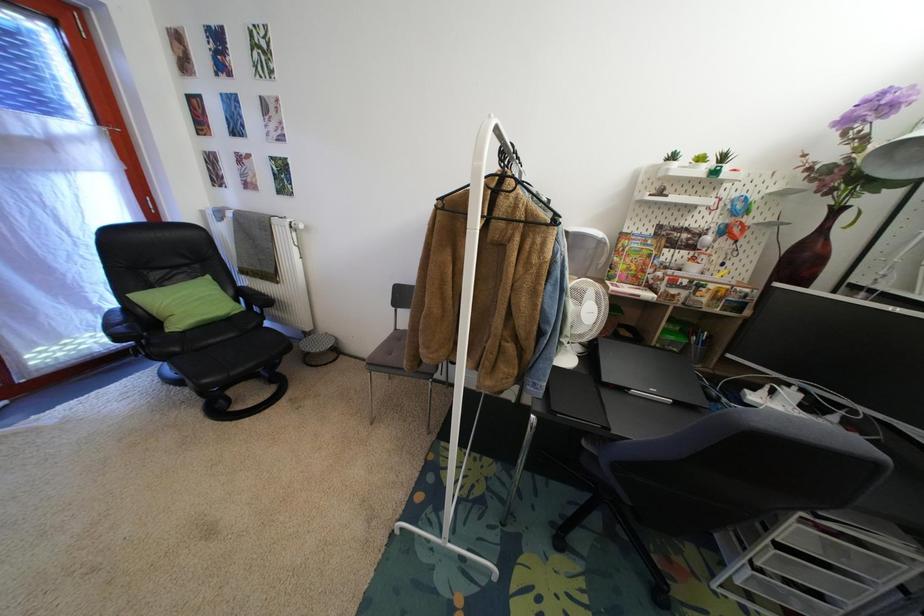
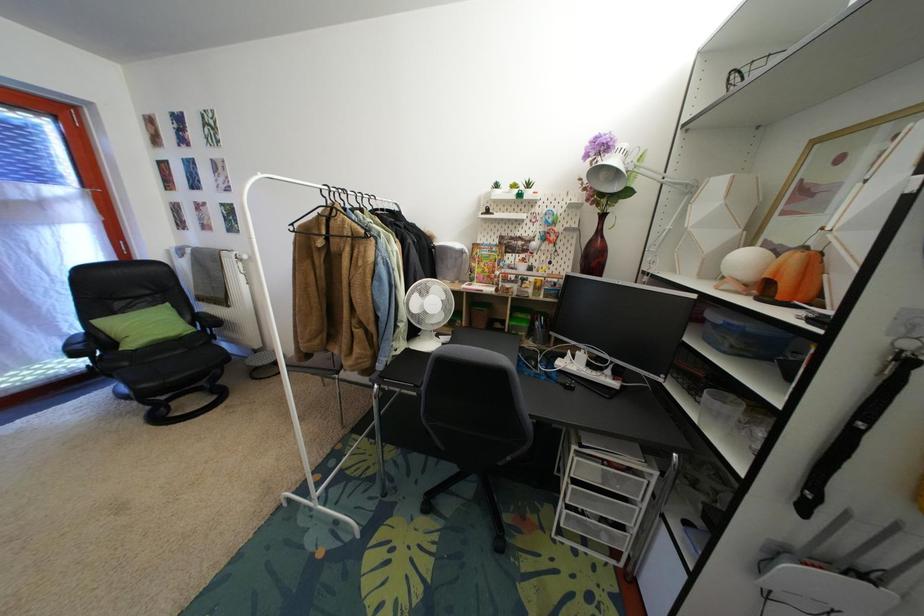
The images are taken continuously from a first-person perspective. In which direction are you moving?

The cameraman walked toward right, backward.